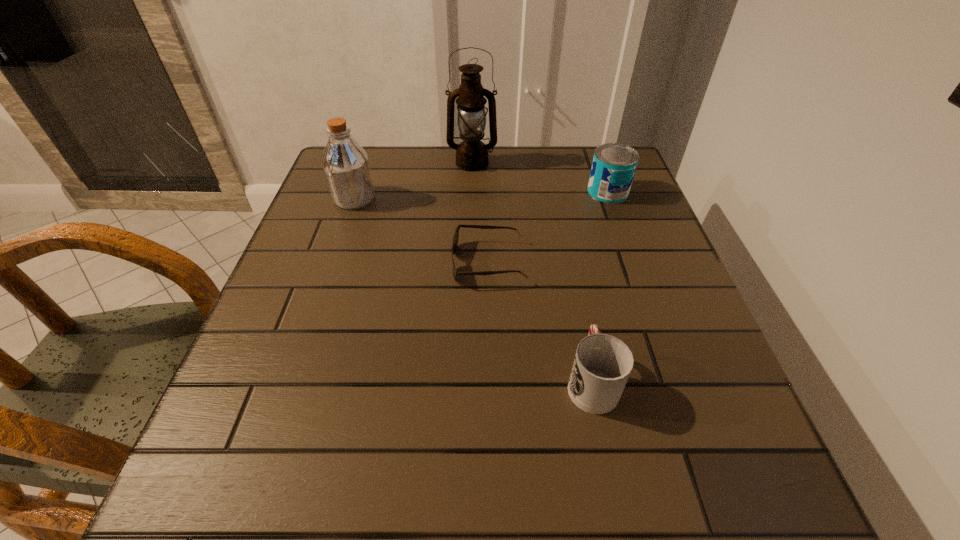
This screenshot has width=960, height=540. Identify the location of free point between the rightmost object and the nearest object. (600, 287).

Identify the location of vacant space that is in between the leftmost object and the shortest object. Image resolution: width=960 pixels, height=540 pixels. (421, 231).

Identify the location of free spot between the second object from right to left and the rightmost object. Image resolution: width=960 pixels, height=540 pixels. (600, 287).

Image resolution: width=960 pixels, height=540 pixels. Find the location of `free space between the fourth farthest object and the oil lamp`. free space between the fourth farthest object and the oil lamp is located at coordinates (481, 213).

At what (x,y) coordinates should I click in order to perform the action: click on free space between the cup and the rightmost object. Please return your answer as a coordinate pair (x, y). The height and width of the screenshot is (540, 960). Looking at the image, I should click on (600, 287).

In order to click on free space between the sunglasses and the second tallest object in this screenshot , I will do `click(421, 231)`.

Locate an element on the screen. The width and height of the screenshot is (960, 540). vacant region between the farthest object and the sunglasses is located at coordinates (481, 213).

Image resolution: width=960 pixels, height=540 pixels. In order to click on free spot between the farthest object and the shortest object in this screenshot , I will do `click(481, 213)`.

You are a GUI agent. You are given a task and a screenshot of the screen. Output one action in this format:
    pyautogui.click(x=<x>, y=<y>)
    Task: Click on the object that is the second closest to the farthest object
    
    Given the screenshot: What is the action you would take?
    pyautogui.click(x=614, y=164)

What are the coordinates of `the closest object to the leftmost object` in the screenshot? It's located at (471, 154).